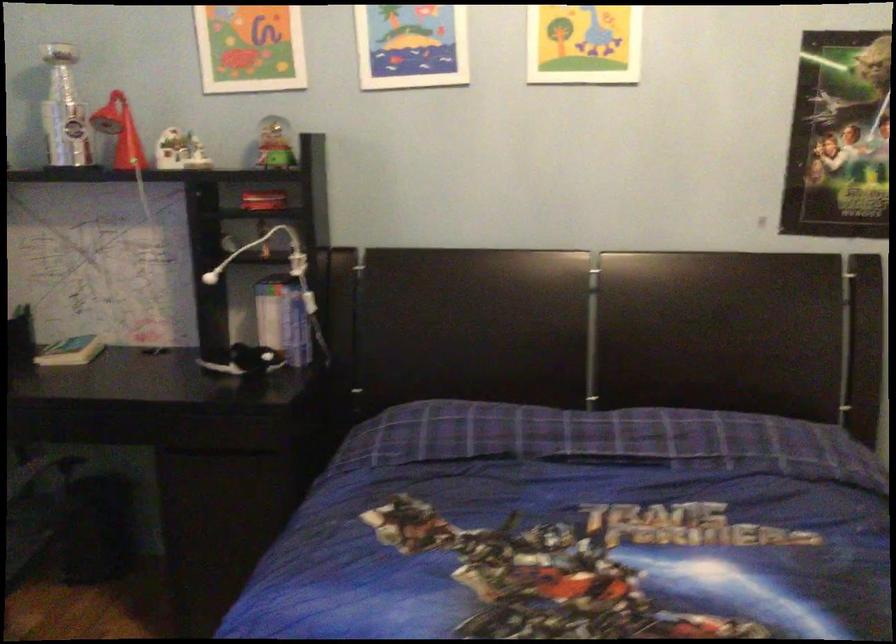
What do you see at coordinates (272, 263) in the screenshot?
I see `the white lamp head` at bounding box center [272, 263].